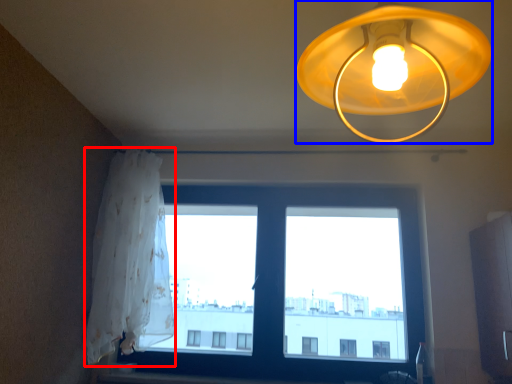
Question: Among these objects, which one is farthest to the camera, curtain (highlighted by a red box) or lamp (highlighted by a blue box)?

Choices:
 (A) curtain
 (B) lamp

Answer: (A)